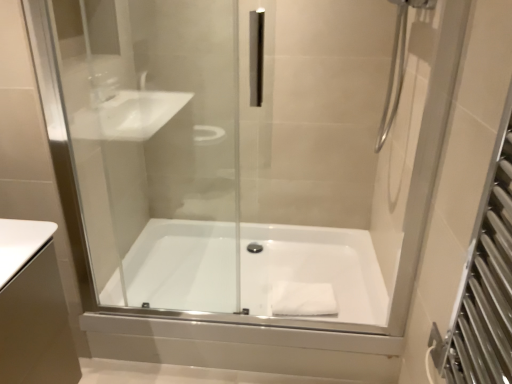
Question: From a real-world perspective, is white glossy bathtub at center positioned over white fabric at bottom based on gravity?

Choices:
 (A) no
 (B) yes

Answer: (A)

Question: From the image's perspective, is white glossy bathtub at center on top of white fabric at bottom?

Choices:
 (A) yes
 (B) no

Answer: (A)

Question: Is white glossy bathtub at center taller than white fabric at bottom?

Choices:
 (A) yes
 (B) no

Answer: (A)

Question: Does white glossy bathtub at center have a greater width compared to white fabric at bottom?

Choices:
 (A) yes
 (B) no

Answer: (A)

Question: From the image's perspective, does white glossy bathtub at center appear lower than white fabric at bottom?

Choices:
 (A) no
 (B) yes

Answer: (A)

Question: Is white glossy bathtub at center at the right side of white fabric at bottom?

Choices:
 (A) no
 (B) yes

Answer: (A)

Question: Does white fabric at bottom appear on the right side of white glossy bathtub at center?

Choices:
 (A) yes
 (B) no

Answer: (A)

Question: Does white fabric at bottom have a lesser width compared to white glossy bathtub at center?

Choices:
 (A) yes
 (B) no

Answer: (A)

Question: Considering the relative sizes of white fabric at bottom and white glossy bathtub at center in the image provided, is white fabric at bottom shorter than white glossy bathtub at center?

Choices:
 (A) no
 (B) yes

Answer: (B)

Question: Does white fabric at bottom have a smaller size compared to white glossy bathtub at center?

Choices:
 (A) no
 (B) yes

Answer: (B)

Question: Is white fabric at bottom with white glossy bathtub at center?

Choices:
 (A) no
 (B) yes

Answer: (A)

Question: From a real-world perspective, is white fabric at bottom beneath white glossy bathtub at center?

Choices:
 (A) no
 (B) yes

Answer: (A)

Question: In terms of height, does white fabric at bottom look taller or shorter compared to white glossy bathtub at center?

Choices:
 (A) tall
 (B) short

Answer: (B)